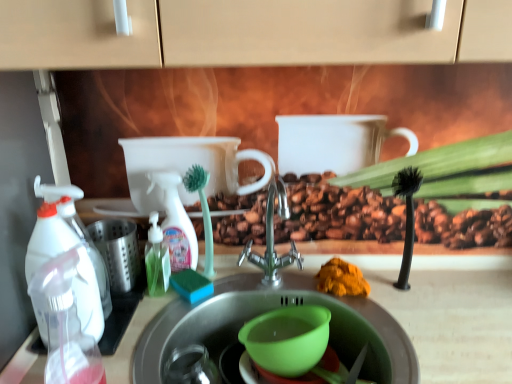
Identify the location of free space to the left of satin nickel faucet at center. (205, 299).